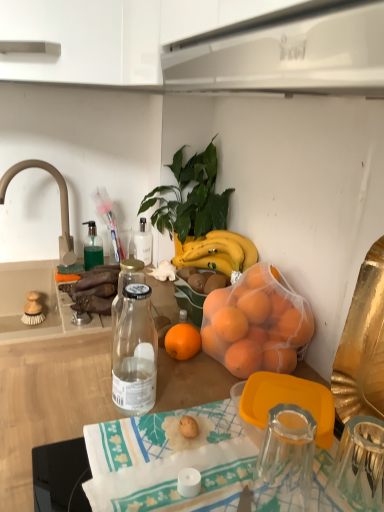
What do you see at coordinates (256, 324) in the screenshot? I see `orange mesh bag at center` at bounding box center [256, 324].

What do you see at coordinates (168, 461) in the screenshot? The image size is (384, 512). I see `printed fabric tablecloth at center` at bounding box center [168, 461].

The height and width of the screenshot is (512, 384). Describe the element at coordinates (287, 52) in the screenshot. I see `white glossy range hood at upper center` at that location.

The image size is (384, 512). What do you see at coordinates (92, 247) in the screenshot?
I see `translucent glass soap dispenser at upper left` at bounding box center [92, 247].

I want to click on green leafy plant at upper center, so click(x=190, y=197).

The width and height of the screenshot is (384, 512). I want to click on orange mesh bag at center, so click(x=256, y=324).

From a real-world perspective, is green leafy plant at upper center on white glossy range hood at upper center?

No, from a real-world perspective, green leafy plant at upper center is not on top of white glossy range hood at upper center.

This screenshot has height=512, width=384. In order to click on kitchen appliance lying on the right of green leafy plant at upper center in this screenshot , I will do (x=287, y=52).

Considering the relative positions of green leafy plant at upper center and white glossy range hood at upper center in the image provided, is green leafy plant at upper center to the left of white glossy range hood at upper center from the viewer's perspective?

Correct, you'll find green leafy plant at upper center to the left of white glossy range hood at upper center.

Which object is further away from the camera, printed fabric tablecloth at center or translucent glass soap dispenser at upper left?

translucent glass soap dispenser at upper left is further from the camera.

Between point (101, 498) and point (91, 247), which one is positioned in front?

The point (101, 498) is more forward.

How many degrees apart are the facing directions of printed fabric tablecloth at center and translucent glass soap dispenser at upper left?

88.2 degrees.

Is printed fabric tablecloth at center oriented away from translucent glass soap dispenser at upper left?

No, printed fabric tablecloth at center's orientation is not away from translucent glass soap dispenser at upper left.

Is green leafy plant at upper center facing away from translucent glass soap dispenser at upper left?

No, green leafy plant at upper center is not facing the opposite direction of translucent glass soap dispenser at upper left.

This screenshot has width=384, height=512. In order to click on houseplant above the translucent glass soap dispenser at upper left (from the image's perspective) in this screenshot , I will do (x=190, y=197).

Considering the positions of objects green leafy plant at upper center and translucent glass soap dispenser at upper left in the image provided, who is behind, green leafy plant at upper center or translucent glass soap dispenser at upper left?

translucent glass soap dispenser at upper left.

I want to click on tablecloth on the left of transparent glass coffee cup at center, so click(168, 461).

How different are the orientations of transparent glass coffee cup at center and printed fabric tablecloth at center in degrees?

They differ by 0.274 degrees in their facing directions.

Can you see transparent glass coffee cup at center touching printed fabric tablecloth at center?

No, transparent glass coffee cup at center is not in contact with printed fabric tablecloth at center.

Would you say white glossy range hood at upper center is inside or outside orange mesh bag at center?

white glossy range hood at upper center is spatially situated outside orange mesh bag at center.

Considering the positions of objects white glossy range hood at upper center and orange mesh bag at center in the image provided, who is in front, white glossy range hood at upper center or orange mesh bag at center?

Positioned in front is white glossy range hood at upper center.

Which is farther from the camera, (170, 53) or (285, 329)?

The point (285, 329) is farther.

How different are the orientations of beige matte faucet at upper left and transparent glass coffee cup at center in degrees?

They differ by 88.1 degrees in their facing directions.

Is beige matte faucet at upper left further to the viewer compared to transparent glass coffee cup at center?

Yes, it is.

Is beige matte faucet at upper left not near transparent glass coffee cup at center?

Yes, beige matte faucet at upper left is far from transparent glass coffee cup at center.

Would you say beige matte faucet at upper left is inside or outside transparent glass coffee cup at center?

beige matte faucet at upper left cannot be found inside transparent glass coffee cup at center.

The image size is (384, 512). I want to click on tablecloth on the right side of green leafy plant at upper center, so click(168, 461).

From the image's perspective, between printed fabric tablecloth at center and green leafy plant at upper center, who is located below?

printed fabric tablecloth at center.

Would you say printed fabric tablecloth at center is a long distance from green leafy plant at upper center?

No, there isn't a large distance between printed fabric tablecloth at center and green leafy plant at upper center.

Does printed fabric tablecloth at center turn towards green leafy plant at upper center?

No, printed fabric tablecloth at center is not facing towards green leafy plant at upper center.

Where is `houseplant lying on the left of white glossy range hood at upper center`? Image resolution: width=384 pixels, height=512 pixels. houseplant lying on the left of white glossy range hood at upper center is located at coordinates (190, 197).

At what (x,y) coordinates should I click in order to perform the action: click on tablecloth located underneath the translucent glass soap dispenser at upper left (from a real-world perspective). Please return your answer as a coordinate pair (x, y). Looking at the image, I should click on (168, 461).

Looking at the image, which one is located closer to green leafy plant at upper center, white glossy range hood at upper center or beige matte faucet at upper left?

beige matte faucet at upper left lies closer to green leafy plant at upper center than the other object.

Looking at the image, which one is located further to orange mesh bag at center, beige matte faucet at upper left or translucent glass soap dispenser at upper left?

beige matte faucet at upper left.

Which object lies nearer to the anchor point green leafy plant at upper center, translucent glass soap dispenser at upper left or beige matte faucet at upper left?

translucent glass soap dispenser at upper left lies closer to green leafy plant at upper center than the other object.

Consider the image. Looking at the image, which one is located further to white glossy range hood at upper center, orange mesh bag at center or green leafy plant at upper center?

green leafy plant at upper center.

Looking at the image, which one is located further to orange mesh bag at center, beige matte faucet at upper left or white glossy range hood at upper center?

beige matte faucet at upper left.

Looking at the image, which one is located closer to translucent glass soap dispenser at upper left, beige matte faucet at upper left or printed fabric tablecloth at center?

Based on the image, beige matte faucet at upper left appears to be nearer to translucent glass soap dispenser at upper left.

Based on their spatial positions, is orange mesh bag at center or translucent glass soap dispenser at upper left closer to green leafy plant at upper center?

translucent glass soap dispenser at upper left is closer to green leafy plant at upper center.

Based on their spatial positions, is orange mesh bag at center or transparent glass coffee cup at center closer to beige matte faucet at upper left?

orange mesh bag at center lies closer to beige matte faucet at upper left than the other object.

Identify the location of houseplant located between white glossy range hood at upper center and translucent glass soap dispenser at upper left in the depth direction. The width and height of the screenshot is (384, 512). (190, 197).

I want to click on tablecloth positioned between white glossy range hood at upper center and green leafy plant at upper center from near to far, so click(168, 461).

Identify the location of houseplant positioned between transparent glass coffee cup at center and beige matte faucet at upper left from near to far. (190, 197).

Locate an element on the screen. This screenshot has width=384, height=512. orange between printed fabric tablecloth at center and beige matte faucet at upper left from front to back is located at coordinates (256, 324).